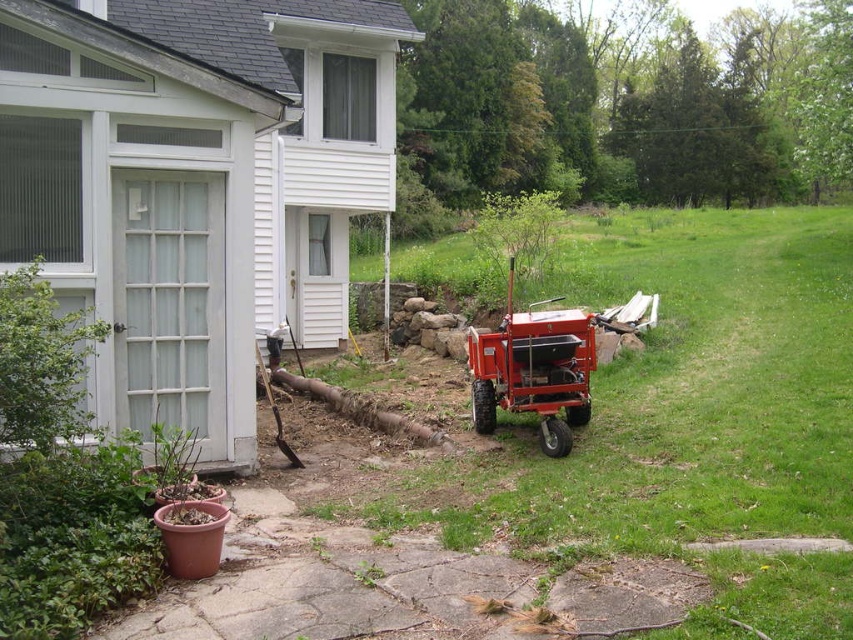
You are planning to mow the lawn using the orange metallic tractor at center. The green grass at center needs to be cut. Can the tractor fit on the grass area?

The green grass at center has a larger size compared to orange metallic tractor at center, so the tractor can fit on the grass area since the grass area is bigger than the tractor.

You are standing in front of the house and want to walk to the green grass at center. Based on the coordinates provided, in which direction should you move from your current position?

The green grass at center is located at coordinates point (677, 397), so you should move towards the center of the image to reach it.

You are a gardener who needs to move the orange metallic tractor at center to the side to access the green grass at center for mowing. Based on their positions, which direction should you move the tractor to reach the grass?

The green grass at center is positioned on the right side of the orange metallic tractor at center, so you should move the tractor to the left to access the grass.